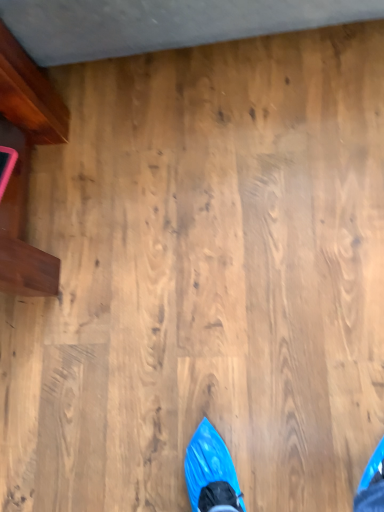
Question: Should I look upward or downward to see wooden desk at left?

Choices:
 (A) up
 (B) down

Answer: (A)